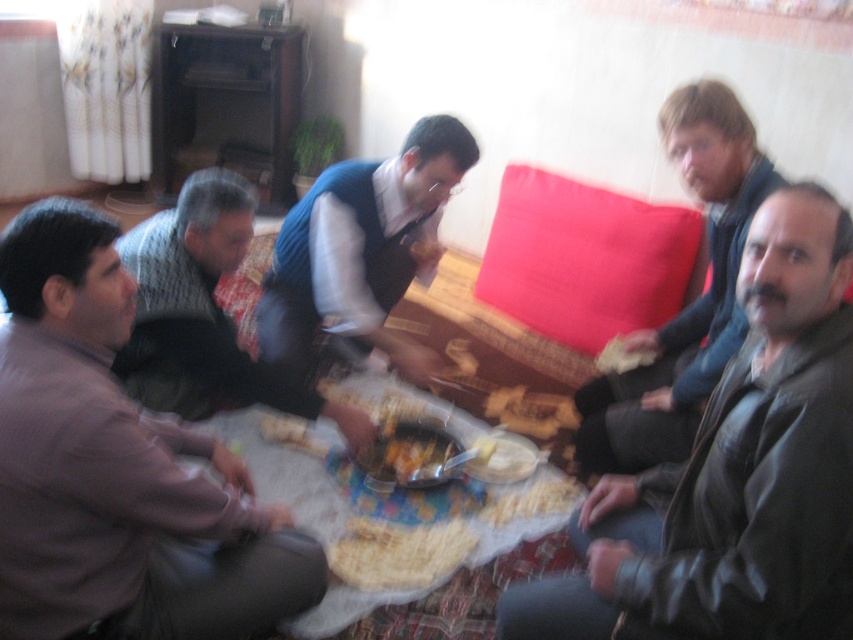
Does point (753, 465) lie behind point (610, 362)?

No, it is in front of (610, 362).

Looking at this image, is the position of leather jacket at lower right less distant than that of yellowish matte bread at center?

Yes, leather jacket at lower right is closer to the viewer.

Which is behind, point (769, 602) or point (637, 353)?

The point (637, 353) is behind.

Identify the location of leather jacket at lower right. This screenshot has width=853, height=640. (735, 474).

Looking at this image, between dark brown leather jacket at right and yellowish matte bread at center, which one appears on the left side from the viewer's perspective?

yellowish matte bread at center is more to the left.

Is dark brown leather jacket at right to the left of yellowish matte bread at center from the viewer's perspective?

Incorrect, dark brown leather jacket at right is not on the left side of yellowish matte bread at center.

Is point (746, 320) behind point (608, 358)?

No, it is not.

The image size is (853, 640). I want to click on dark brown leather jacket at right, so click(688, 305).

Between brown textured shirt at left and knitted sweater at lower left, which one has less height?

knitted sweater at lower left is shorter.

From the picture: Can you confirm if brown textured shirt at left is thinner than knitted sweater at lower left?

Yes.

Describe the element at coordinates (115, 468) in the screenshot. The image size is (853, 640). I see `brown textured shirt at left` at that location.

The height and width of the screenshot is (640, 853). Identify the location of brown textured shirt at left. (115, 468).